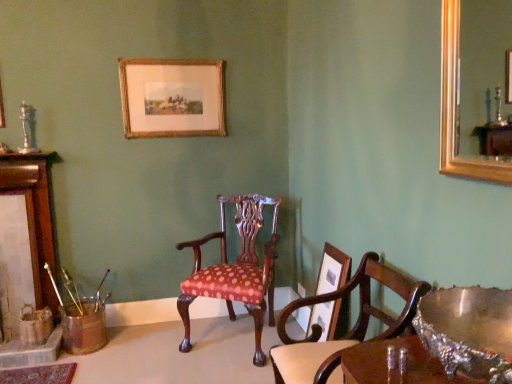
Identify the location of vacant space positioned to the left of polka dot fabric chair at center, the 2th chair from the front. This screenshot has width=512, height=384. (150, 345).